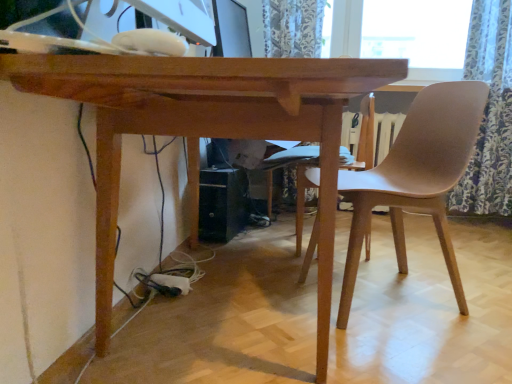
Question: Is wooden table at center shorter than white glossy monitor at upper center?

Choices:
 (A) yes
 (B) no

Answer: (B)

Question: From a real-world perspective, does wooden table at center stand above white glossy monitor at upper center?

Choices:
 (A) no
 (B) yes

Answer: (A)

Question: Is wooden table at center positioned beyond the bounds of white glossy monitor at upper center?

Choices:
 (A) yes
 (B) no

Answer: (A)

Question: From a real-world perspective, is wooden table at center beneath white glossy monitor at upper center?

Choices:
 (A) no
 (B) yes

Answer: (B)

Question: Can you confirm if wooden table at center is wider than white glossy monitor at upper center?

Choices:
 (A) no
 (B) yes

Answer: (B)

Question: Does wooden table at center turn towards white glossy monitor at upper center?

Choices:
 (A) yes
 (B) no

Answer: (B)

Question: Is white glossy monitor at upper center closer to the viewer compared to matte black monitor at upper center?

Choices:
 (A) no
 (B) yes

Answer: (B)

Question: From a real-world perspective, is white glossy monitor at upper center under matte black monitor at upper center?

Choices:
 (A) no
 (B) yes

Answer: (B)

Question: Is white glossy monitor at upper center aimed at matte black monitor at upper center?

Choices:
 (A) yes
 (B) no

Answer: (B)

Question: Is white glossy monitor at upper center beside matte black monitor at upper center?

Choices:
 (A) yes
 (B) no

Answer: (B)

Question: Is white glossy monitor at upper center further to camera compared to matte black monitor at upper center?

Choices:
 (A) no
 (B) yes

Answer: (A)

Question: Is white glossy monitor at upper center to the left of matte black monitor at upper center from the viewer's perspective?

Choices:
 (A) no
 (B) yes

Answer: (B)

Question: Can you confirm if floral fabric curtain at right is shorter than matte black monitor at upper center?

Choices:
 (A) no
 (B) yes

Answer: (A)